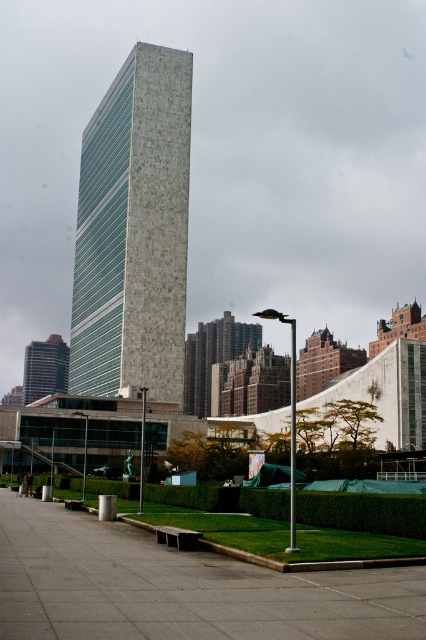
You are standing on the gray concrete pavement at lower center and want to reach the dark gray stone building at lower left. Which direction should you walk to get closer to the building?

You should walk towards the lower left direction to get closer to the dark gray stone building at lower left since the gray concrete pavement at lower center is shorter than the building, indicating it is closer to the building in that direction.

You are a city planner evaluating the urban layout. The white stone tower at center and the dark gray stone building at lower left are both part of the city skyline. Which one would cast a longer shadow during midday in summer?

The white stone tower at center has a greater height compared to the dark gray stone building at lower left, so it would cast a longer shadow during midday in summer.